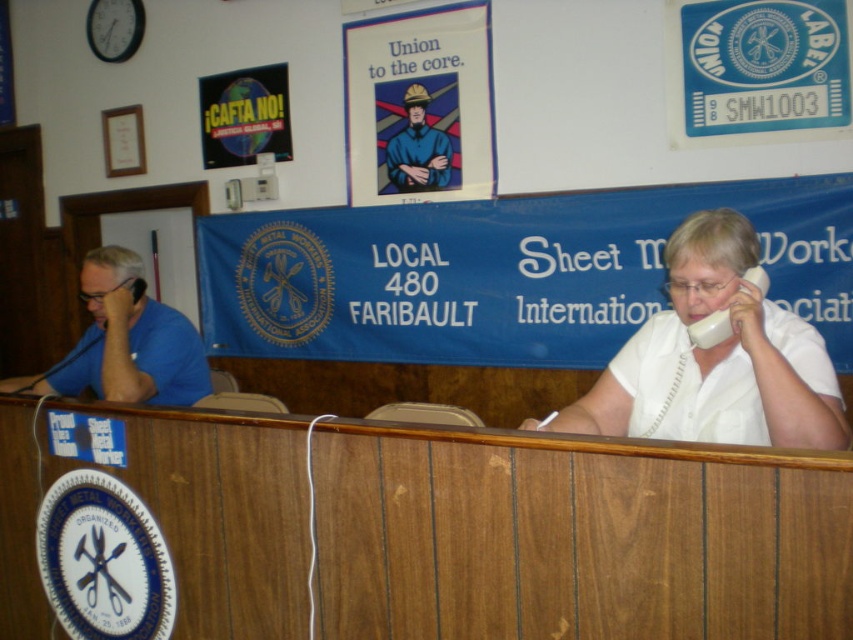
Between point (650, 554) and point (419, 176), which one is positioned in front?

Point (650, 554)

Which is behind, point (595, 490) or point (413, 92)?

The point (413, 92) is more distant.

Is point (601, 541) closer to viewer compared to point (419, 161)?

Yes, it is in front of point (419, 161).

Find the location of a particular element. The image size is (853, 640). wooden table at center is located at coordinates (573, 536).

Does wooden table at center have a smaller size compared to white glossy phone at center?

No, wooden table at center is not smaller than white glossy phone at center.

Find the location of a particular element. Image resolution: width=853 pixels, height=640 pixels. wooden table at center is located at coordinates (573, 536).

At what (x,y) coordinates should I click in order to perform the action: click on wooden table at center. Please return your answer as a coordinate pair (x, y). This screenshot has width=853, height=640. Looking at the image, I should click on (573, 536).

Is white glossy phone at center thinner than matte blue uniform at center?

Incorrect, white glossy phone at center's width is not less than matte blue uniform at center's.

From the picture: Who is more distant from viewer, [674,340] or [424,144]?

The point [424,144] is more distant.

Identify the location of white glossy phone at center. This screenshot has width=853, height=640. (717, 358).